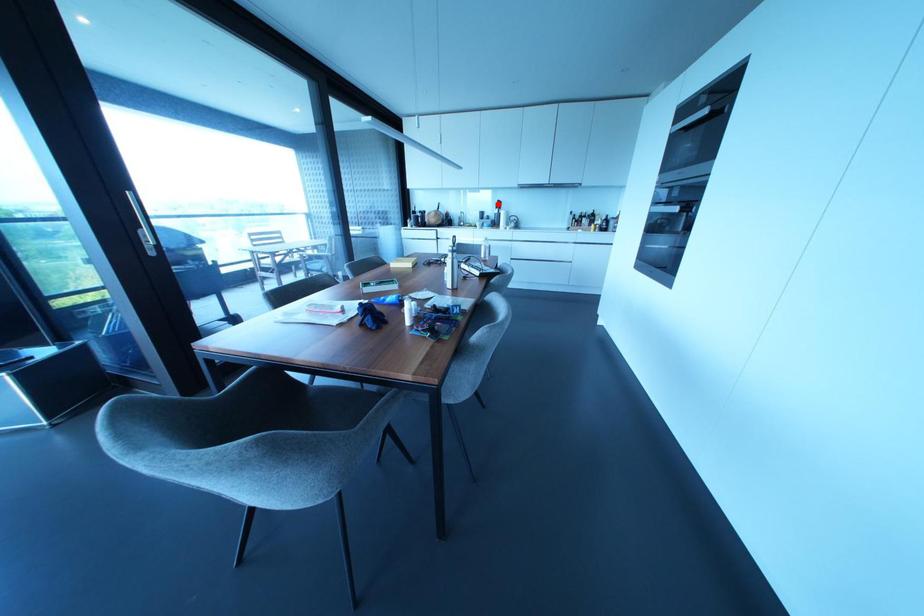
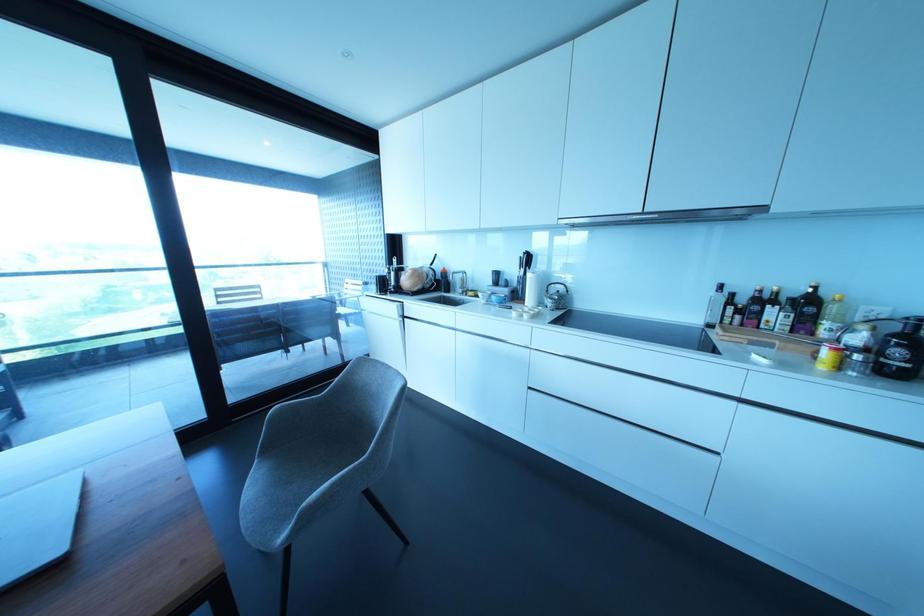
Question: I am providing you with two images of the same scene from different viewpoints. Image1 has a red point marked. In image2, the corresponding 3D location appears at what relative position? Reply with the corresponding letter.

Choices:
 (A) Closer
 (B) Farther

Answer: (B)